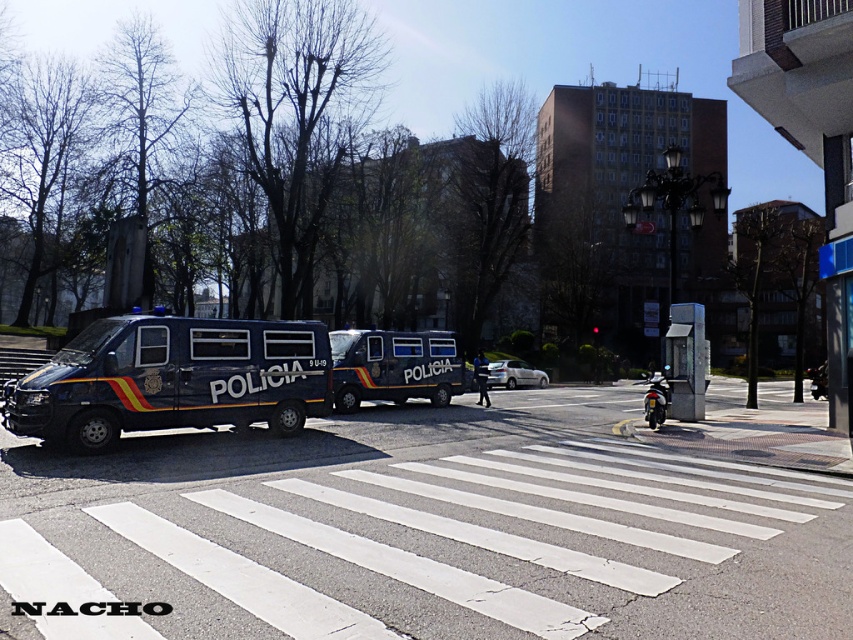
Question: Which object is the farthest from the white matte car at center?

Choices:
 (A) polished blue van at center
 (B) shiny chrome motorcycle at right

Answer: (B)

Question: Which object appears closest to the camera in this image?

Choices:
 (A) metallic blue van at left
 (B) shiny chrome motorcycle at right

Answer: (A)

Question: Is the position of polished blue van at center less distant than that of shiny chrome motorcycle at right?

Choices:
 (A) yes
 (B) no

Answer: (A)

Question: Does metallic blue van at left have a larger size compared to shiny chrome motorcycle at right?

Choices:
 (A) no
 (B) yes

Answer: (A)

Question: Which of the following is the farthest from the observer?

Choices:
 (A) (538, 378)
 (B) (654, 412)
 (C) (227, 388)

Answer: (A)

Question: Is polished blue van at center to the left of white matte car at center from the viewer's perspective?

Choices:
 (A) yes
 (B) no

Answer: (A)